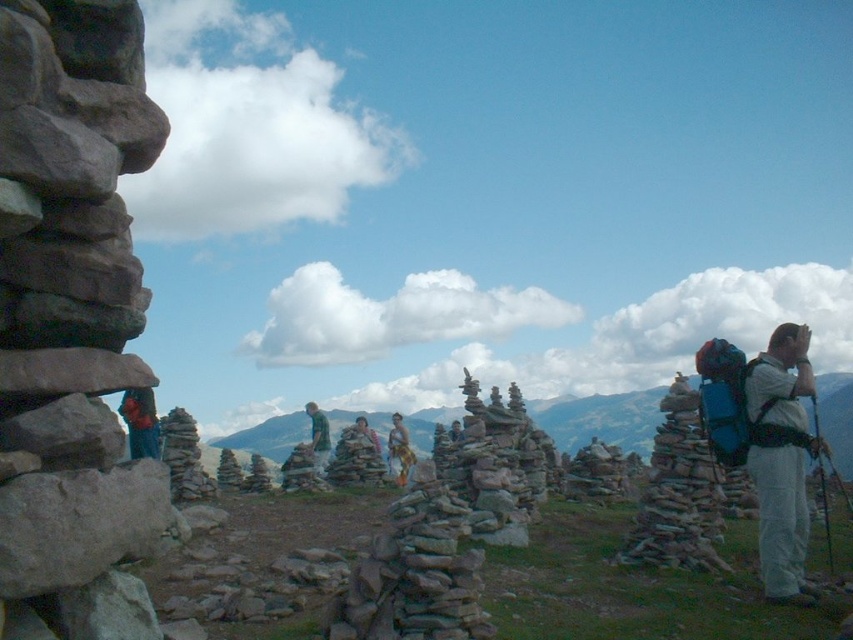
Can you confirm if camouflage fabric pants at center is positioned to the right of camouflage fabric jacket at center?

Yes, camouflage fabric pants at center is to the right of camouflage fabric jacket at center.

From the picture: Does camouflage fabric pants at center appear over camouflage fabric jacket at center?

Actually, camouflage fabric pants at center is below camouflage fabric jacket at center.

Describe the element at coordinates (399, 449) in the screenshot. I see `camouflage fabric pants at center` at that location.

Identify the location of camouflage fabric pants at center. This screenshot has height=640, width=853. [x=399, y=449].

Which is more to the left, blue fabric backpack at left or camouflage fabric jacket at center?

From the viewer's perspective, blue fabric backpack at left appears more on the left side.

Who is more forward, (x=152, y=396) or (x=380, y=449)?

Positioned in front is point (x=152, y=396).

Is point (149, 403) positioned in front of point (366, 422)?

Yes, it is in front of point (366, 422).

Identify the location of blue fabric backpack at left. (140, 422).

Is the position of white matte backpack at right less distant than that of camouflage fabric jacket at center?

That is True.

Who is shorter, white matte backpack at right or camouflage fabric jacket at center?

With less height is camouflage fabric jacket at center.

Does point (793, 593) lie behind point (370, 433)?

No, it is in front of (370, 433).

Identify the location of white matte backpack at right. (781, 458).